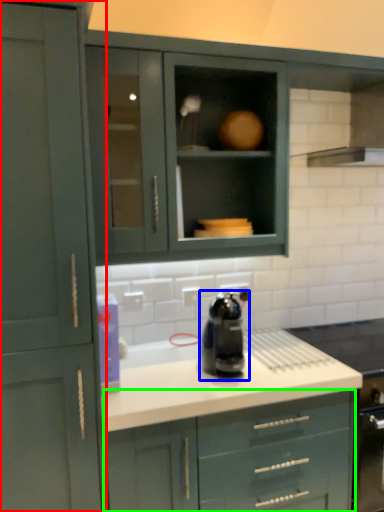
Question: Which object is the closest to the cabinetry (highlighted by a red box)? Choose among these: home appliance (highlighted by a blue box) or cabinetry (highlighted by a green box).

Choices:
 (A) home appliance
 (B) cabinetry

Answer: (B)